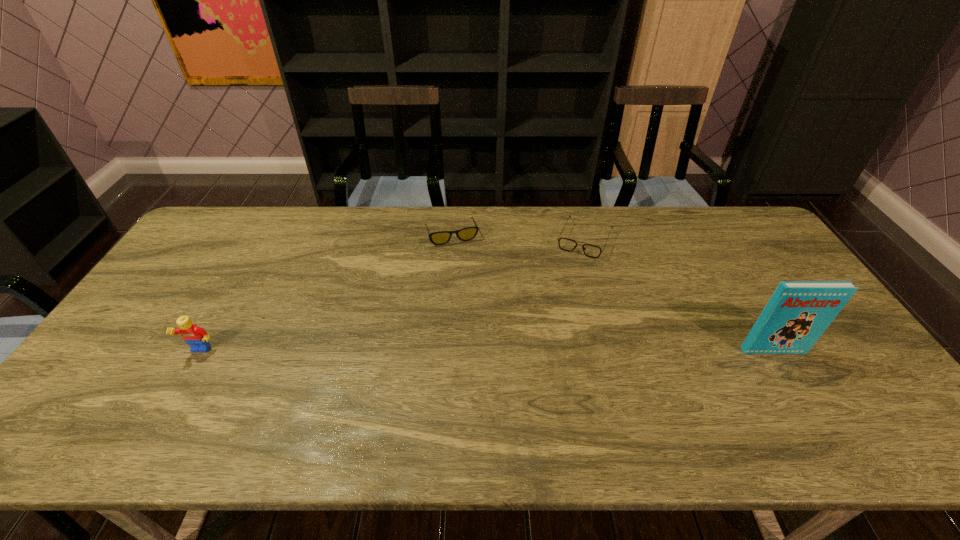
Where is `object that ranks as the third closest to the third object from right to left`? This screenshot has width=960, height=540. object that ranks as the third closest to the third object from right to left is located at coordinates tap(797, 314).

At what (x,y) coordinates should I click in order to perform the action: click on free space that satisfies the following two spatial constraints: 1. on the front side of the left sunglasses; 2. on the right side of the right sunglasses. Please return your answer as a coordinate pair (x, y). This screenshot has height=540, width=960. Looking at the image, I should click on (451, 240).